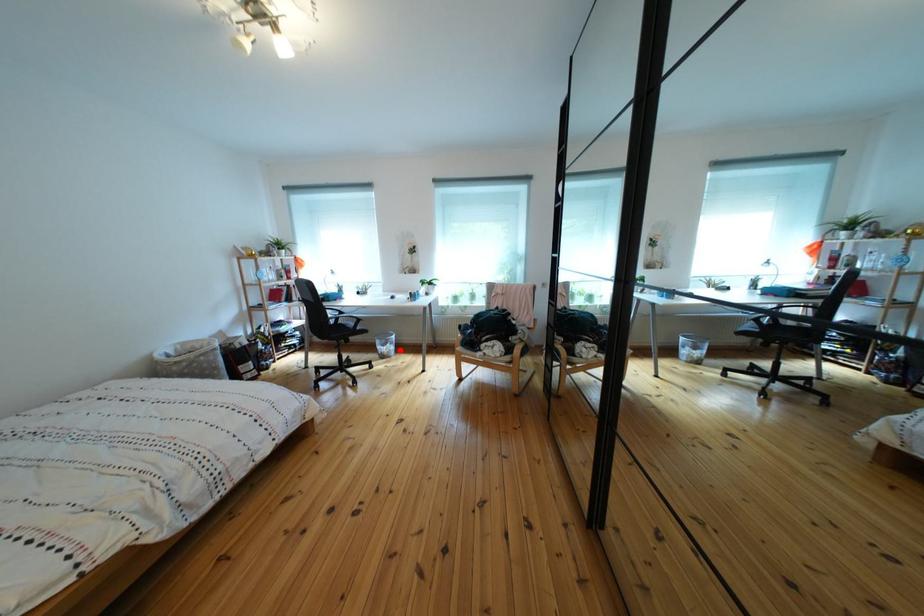
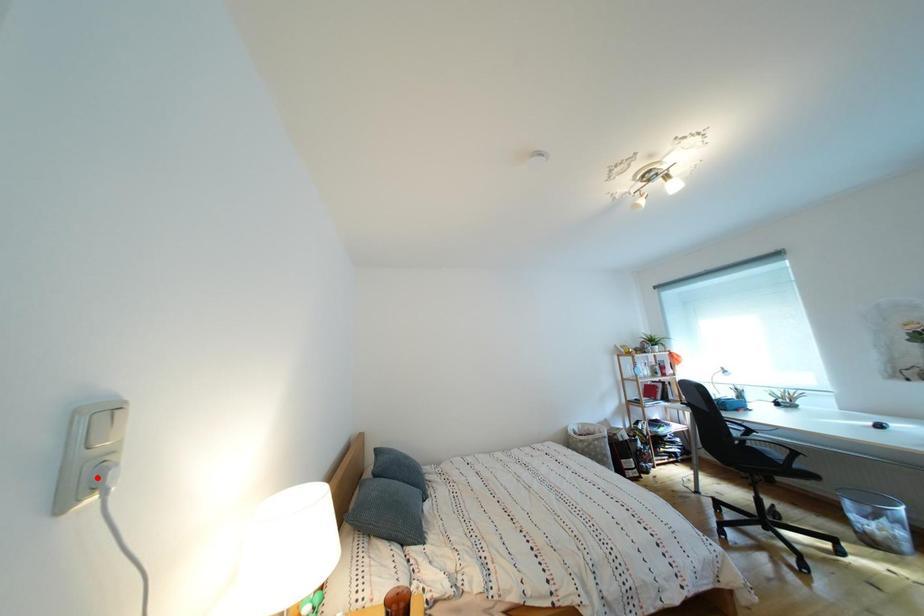
I am providing you with two images of the same scene from different viewpoints. A red point is marked on the first image and another point is marked on the second image. Is the red point in image1 aligned with the point shown in image2?

No